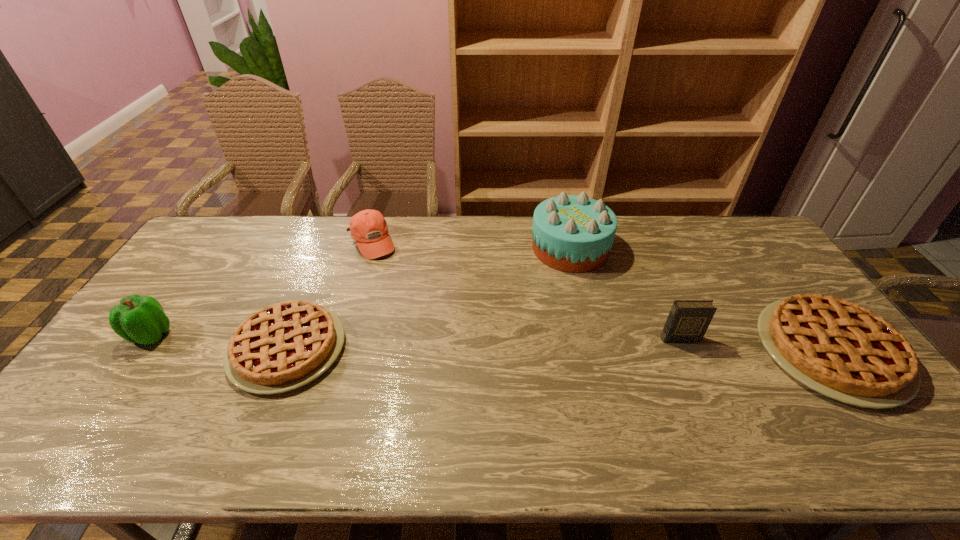
Find the location of a particular element. The height and width of the screenshot is (540, 960). blank space at the near edge is located at coordinates [x=825, y=417].

Find the location of a particular element. Image resolution: width=960 pixels, height=540 pixels. free space at the far left corner of the desktop is located at coordinates (222, 235).

In the image, there is a desktop. Identify the location of vacant space at the far right corner. (734, 224).

You are a GUI agent. You are given a task and a screenshot of the screen. Output one action in this format:
    pyautogui.click(x=<x>, y=<y>)
    Task: Click on the blank region between the shortest object and the bell pepper
    This screenshot has height=540, width=960.
    Given the screenshot: What is the action you would take?
    pyautogui.click(x=219, y=342)

Find the location of `free space between the taller pie and the shorter pie`. free space between the taller pie and the shorter pie is located at coordinates (559, 350).

Where is `empty space between the shortest object and the fourth tallest object`? Image resolution: width=960 pixels, height=540 pixels. empty space between the shortest object and the fourth tallest object is located at coordinates point(329,295).

Find the location of `blank region between the shorter pie and the third shortest object`. blank region between the shorter pie and the third shortest object is located at coordinates (329, 295).

Locate an element on the screen. This screenshot has width=960, height=540. vacant area between the second object from right to left and the right pie is located at coordinates (755, 345).

Locate an element on the screen. The height and width of the screenshot is (540, 960). unoccupied position between the shorter pie and the leftmost object is located at coordinates tap(219, 342).

Identify the location of free space between the fourth tallest object and the right pie. (601, 297).